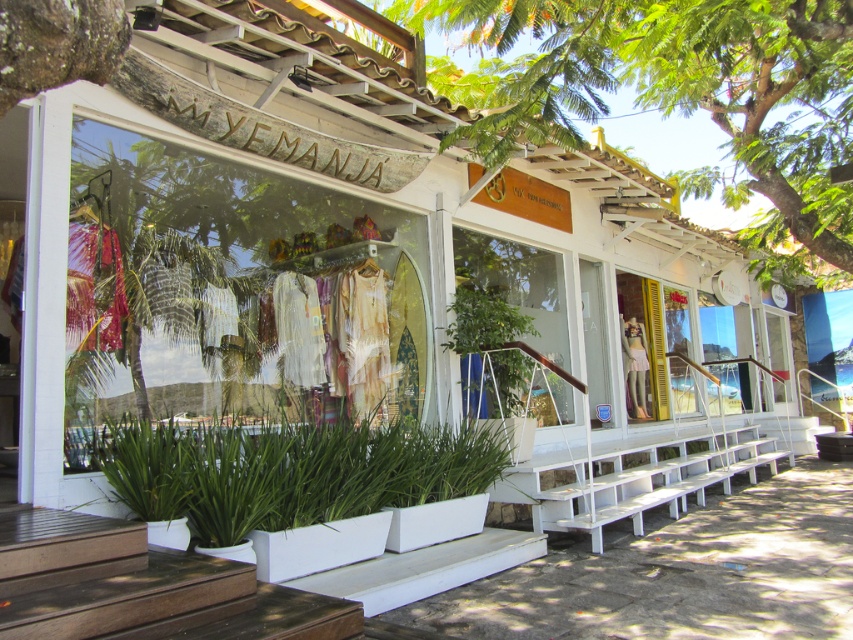
Who is lower down, green leafy tree at upper center or green leafy plant at lower center?

green leafy plant at lower center is lower down.

Is point (553, 22) more distant than point (323, 500)?

Yes, it is behind point (323, 500).

What do you see at coordinates (677, 97) in the screenshot?
I see `green leafy tree at upper center` at bounding box center [677, 97].

Where is `green leafy tree at upper center`? green leafy tree at upper center is located at coordinates pos(677,97).

Which is more to the right, matte glass shop window at center or green leafy plant at lower center?

Positioned to the right is green leafy plant at lower center.

Is matte glass shop window at center closer to camera compared to green leafy plant at lower center?

No, it is not.

What are the coordinates of `matte glass shop window at center` in the screenshot? It's located at (233, 292).

The height and width of the screenshot is (640, 853). What are the coordinates of `matte glass shop window at center` in the screenshot? It's located at (233, 292).

Between matte glass shop window at center and green leafy tree at upper center, which one is positioned lower?

matte glass shop window at center is lower down.

Which is behind, point (300, 186) or point (711, 109)?

Positioned behind is point (711, 109).

Where is `matte glass shop window at center`? The height and width of the screenshot is (640, 853). matte glass shop window at center is located at coordinates (233, 292).